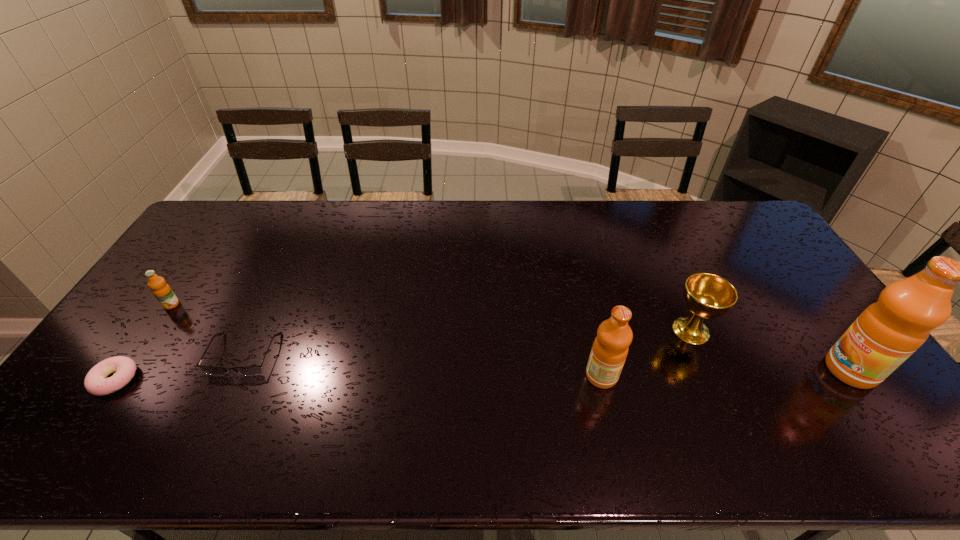
Please show where to add a fruit juice on the left while keeping spacing even. Please provide its 2D coordinates. Your answer should be formatted as a tuple, i.e. [(x, y)], where the tuple contains the x and y coordinates of a point satisfying the conditions above.

[(347, 382)]